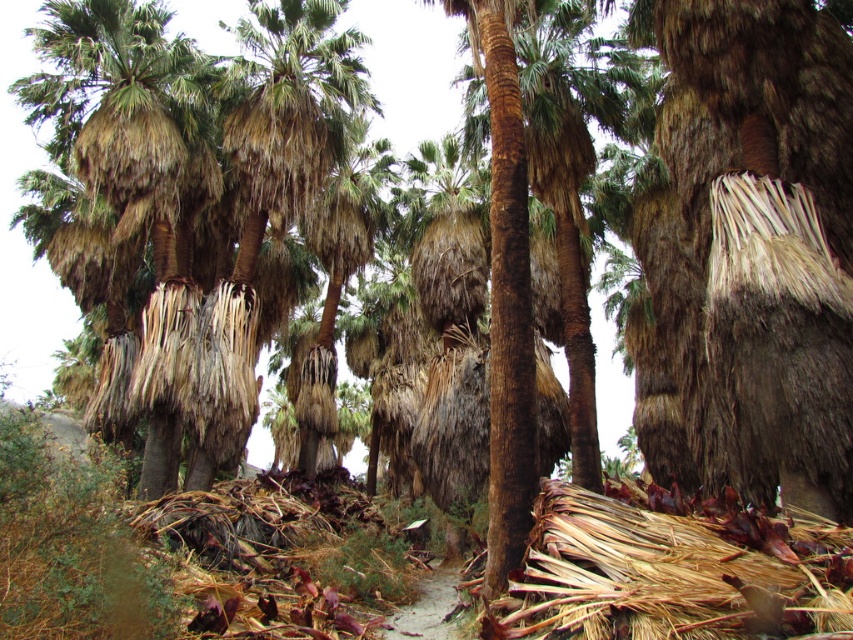
Question: In this image, where is brown textured palm tree at lower left located relative to brown dirt path at center?

Choices:
 (A) left
 (B) right

Answer: (A)

Question: Where is brown textured palm tree at lower left located in relation to brown dirt path at center in the image?

Choices:
 (A) below
 (B) above

Answer: (B)

Question: Among these objects, which one is nearest to the camera?

Choices:
 (A) brown dirt path at center
 (B) brown textured palm tree at lower left

Answer: (B)

Question: Among these points, which one is nearest to the camera?

Choices:
 (A) (160, 19)
 (B) (381, 628)

Answer: (B)

Question: Which point is farther from the camera taking this photo?

Choices:
 (A) (419, 632)
 (B) (173, 170)

Answer: (B)

Question: Can you confirm if brown textured palm tree at lower left is positioned to the right of brown dirt path at center?

Choices:
 (A) yes
 (B) no

Answer: (B)